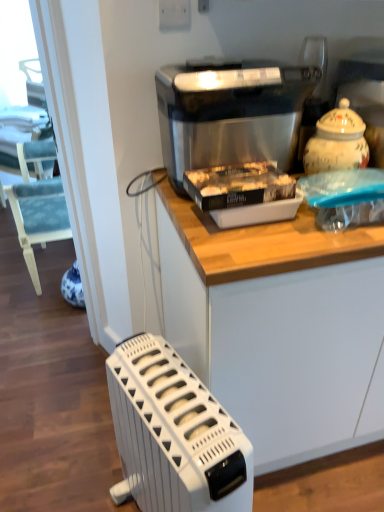
Question: Is point (243, 284) positioned closer to the camera than point (223, 129)?

Choices:
 (A) farther
 (B) closer

Answer: (B)

Question: Looking at their shapes, would you say white matte cabinet at upper center is wider or thinner than stainless steel ice maker at center?

Choices:
 (A) wide
 (B) thin

Answer: (A)

Question: Estimate the real-world distances between objects in this image. Which object is closer to the white plastic radiator at lower left?

Choices:
 (A) white matte cabinet at upper center
 (B) stainless steel ice maker at center

Answer: (A)

Question: Which object is the closest to the stainless steel ice maker at center?

Choices:
 (A) white plastic radiator at lower left
 (B) white matte cabinet at upper center

Answer: (B)